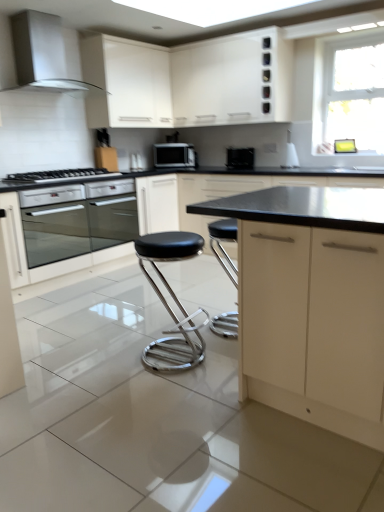
At what (x,y) coordinates should I click in order to perform the action: click on satin silver range hood at upper left. Please return your answer as a coordinate pair (x, y). Looking at the image, I should click on (42, 54).

Describe the element at coordinates (42, 54) in the screenshot. I see `satin silver range hood at upper left` at that location.

Where is `white matte cabinet at upper center, which appears as the 1th cabinetry when viewed from the top`? The height and width of the screenshot is (512, 384). white matte cabinet at upper center, which appears as the 1th cabinetry when viewed from the top is located at coordinates (188, 81).

The image size is (384, 512). What do you see at coordinates (227, 193) in the screenshot? I see `black matte cabinet at center, positioned as the 2th cabinetry in bottom-to-top order` at bounding box center [227, 193].

At what (x,y) coordinates should I click in order to perform the action: click on white matte cabinet at upper center, which ranks as the second cabinetry in top-to-bottom order. Please return your answer as a coordinate pair (x, y). Image resolution: width=384 pixels, height=512 pixels. Looking at the image, I should click on (126, 83).

The width and height of the screenshot is (384, 512). Describe the element at coordinates (312, 304) in the screenshot. I see `matte cream cabinet at center, the 1th cabinetry positioned from the bottom` at that location.

Locate an element on the screen. matte cream cabinet at center, acting as the fourth cabinetry starting from the top is located at coordinates (312, 304).

Where is `matte black microwave at center`? This screenshot has width=384, height=512. matte black microwave at center is located at coordinates (174, 155).

What do you see at coordinates (240, 158) in the screenshot?
I see `black glossy toaster at center` at bounding box center [240, 158].

Where is `satin silver range hood at upper left`? satin silver range hood at upper left is located at coordinates (42, 54).

From the image's perspective, which object appears higher, black leather stool at center or satin silver oven at lower left?

satin silver oven at lower left is shown above in the image.

Looking at this image, does black leather stool at center contain satin silver oven at lower left?

No, satin silver oven at lower left is not a part of black leather stool at center.

From the picture: Could you tell me if black leather stool at center is turned towards satin silver oven at lower left?

No, black leather stool at center is not facing towards satin silver oven at lower left.

Considering the sizes of satin silver oven at lower left and white matte cabinet at upper center, the 3th cabinetry positioned from the bottom, in the image, is satin silver oven at lower left wider or thinner than white matte cabinet at upper center, the 3th cabinetry positioned from the bottom,?

satin silver oven at lower left is wider than white matte cabinet at upper center, the 3th cabinetry positioned from the bottom.

Where is `cabinetry that is the 1st object above the satin silver oven at lower left (from a real-world perspective)`? This screenshot has width=384, height=512. cabinetry that is the 1st object above the satin silver oven at lower left (from a real-world perspective) is located at coordinates (126, 83).

Considering the sizes of objects satin silver oven at lower left and white matte cabinet at upper center, the 3th cabinetry positioned from the bottom, in the image provided, who is taller, satin silver oven at lower left or white matte cabinet at upper center, the 3th cabinetry positioned from the bottom,?

Standing taller between the two is white matte cabinet at upper center, the 3th cabinetry positioned from the bottom.

Considering the sizes of objects matte cream cabinet at center, acting as the fourth cabinetry starting from the top, and satin silver range hood at upper left in the image provided, who is taller, matte cream cabinet at center, acting as the fourth cabinetry starting from the top, or satin silver range hood at upper left?

matte cream cabinet at center, acting as the fourth cabinetry starting from the top.

Is matte cream cabinet at center, the 1th cabinetry positioned from the bottom, behind satin silver range hood at upper left?

No, matte cream cabinet at center, the 1th cabinetry positioned from the bottom, is in front of satin silver range hood at upper left.

What's the angular difference between matte cream cabinet at center, the 1th cabinetry positioned from the bottom, and satin silver range hood at upper left's facing directions?

There is a 179-degree angle between the facing directions of matte cream cabinet at center, the 1th cabinetry positioned from the bottom, and satin silver range hood at upper left.

Which is behind, matte cream cabinet at center, acting as the fourth cabinetry starting from the top, or satin silver oven at lower left?

satin silver oven at lower left is further away from the camera.

Based on the photo, which of these two, matte cream cabinet at center, acting as the fourth cabinetry starting from the top, or satin silver oven at lower left, is thinner?

satin silver oven at lower left.

Can you confirm if matte cream cabinet at center, acting as the fourth cabinetry starting from the top, is positioned to the right of satin silver oven at lower left?

Indeed, matte cream cabinet at center, acting as the fourth cabinetry starting from the top, is positioned on the right side of satin silver oven at lower left.

From the picture: Can you confirm if matte cream cabinet at center, the 1th cabinetry positioned from the bottom, is shorter than satin silver oven at lower left?

No, matte cream cabinet at center, the 1th cabinetry positioned from the bottom, is not shorter than satin silver oven at lower left.

From a real-world perspective, between black leather stool at center and white matte cabinet at upper center, the 3th cabinetry positioned from the bottom, who is vertically higher?

white matte cabinet at upper center, the 3th cabinetry positioned from the bottom.

Which object is further away from the camera taking this photo, black leather stool at center or white matte cabinet at upper center, the 3th cabinetry positioned from the bottom?

white matte cabinet at upper center, the 3th cabinetry positioned from the bottom, is further from the camera.

Is black leather stool at center oriented towards white matte cabinet at upper center, the 3th cabinetry positioned from the bottom?

No, black leather stool at center is not aimed at white matte cabinet at upper center, the 3th cabinetry positioned from the bottom.

Based on the photo, from a real-world perspective, is satin silver oven at lower left on black matte cabinet at center, marked as the 3th cabinetry in a top-to-bottom arrangement?

Yes, from a real-world perspective, satin silver oven at lower left is over black matte cabinet at center, marked as the 3th cabinetry in a top-to-bottom arrangement

Between satin silver oven at lower left and black matte cabinet at center, positioned as the 2th cabinetry in bottom-to-top order, which one has smaller size?

satin silver oven at lower left.

Based on the photo, which is in front, satin silver oven at lower left or black matte cabinet at center, marked as the 3th cabinetry in a top-to-bottom arrangement?

Positioned in front is black matte cabinet at center, marked as the 3th cabinetry in a top-to-bottom arrangement.

Can you tell me how much satin silver oven at lower left and black matte cabinet at center, marked as the 3th cabinetry in a top-to-bottom arrangement, differ in facing direction?

satin silver oven at lower left and black matte cabinet at center, marked as the 3th cabinetry in a top-to-bottom arrangement, are facing 90.3 degrees away from each other.

Considering the sizes of white matte cabinet at upper center, which ranks as the second cabinetry in top-to-bottom order, and matte black microwave at center in the image, is white matte cabinet at upper center, which ranks as the second cabinetry in top-to-bottom order, bigger or smaller than matte black microwave at center?

Considering their sizes, white matte cabinet at upper center, which ranks as the second cabinetry in top-to-bottom order, takes up more space than matte black microwave at center.

Which of these two, white matte cabinet at upper center, the 3th cabinetry positioned from the bottom, or matte black microwave at center, stands shorter?

Standing shorter between the two is matte black microwave at center.

From the image's perspective, is white matte cabinet at upper center, which ranks as the second cabinetry in top-to-bottom order, over matte black microwave at center?

Correct, white matte cabinet at upper center, which ranks as the second cabinetry in top-to-bottom order, appears higher than matte black microwave at center in the image.

This screenshot has height=512, width=384. I want to click on the 1st cabinetry above the matte black microwave at center (from the image's perspective), so click(x=126, y=83).

At what (x,y) coordinates should I click in order to perform the action: click on stool on the right of satin silver oven at lower left. Please return your answer as a coordinate pair (x, y). Looking at the image, I should click on (173, 298).

I want to click on oven lying on the left of white matte cabinet at upper center, the 3th cabinetry positioned from the bottom, so click(77, 219).

Based on their spatial positions, is black matte cabinet at center, positioned as the 2th cabinetry in bottom-to-top order, or satin silver range hood at upper left closer to black leather stool at center?

black matte cabinet at center, positioned as the 2th cabinetry in bottom-to-top order.

Based on their spatial positions, is white matte cabinet at upper center, the 3th cabinetry positioned from the bottom, or black matte cabinet at center, marked as the 3th cabinetry in a top-to-bottom arrangement, closer to satin silver oven at lower left?

The object closer to satin silver oven at lower left is black matte cabinet at center, marked as the 3th cabinetry in a top-to-bottom arrangement.

Considering their positions, is black stainless steel gas stove at left positioned closer to matte cream cabinet at center, acting as the fourth cabinetry starting from the top, than black leather stool at center?

The object closer to matte cream cabinet at center, acting as the fourth cabinetry starting from the top, is black leather stool at center.

Which object lies further to the anchor point black glossy toaster at center, matte black microwave at center or matte cream cabinet at center, the 1th cabinetry positioned from the bottom?

Among the two, matte cream cabinet at center, the 1th cabinetry positioned from the bottom, is located further to black glossy toaster at center.

Estimate the real-world distances between objects in this image. Which object is closer to matte black microwave at center, satin silver range hood at upper left or white matte cabinet at upper center, the 3th cabinetry positioned from the bottom?

white matte cabinet at upper center, the 3th cabinetry positioned from the bottom.

Estimate the real-world distances between objects in this image. Which object is further from black stainless steel gas stove at left, matte cream cabinet at center, the 1th cabinetry positioned from the bottom, or black leather stool at center?

matte cream cabinet at center, the 1th cabinetry positioned from the bottom, is positioned further to the anchor black stainless steel gas stove at left.

Estimate the real-world distances between objects in this image. Which object is closer to white matte cabinet at upper center, arranged as the fourth cabinetry when ordered from the bottom, white matte cabinet at upper center, which ranks as the second cabinetry in top-to-bottom order, or black matte cabinet at center, positioned as the 2th cabinetry in bottom-to-top order?

white matte cabinet at upper center, which ranks as the second cabinetry in top-to-bottom order, lies closer to white matte cabinet at upper center, arranged as the fourth cabinetry when ordered from the bottom, than the other object.

Which object lies further to the anchor point black leather stool at center, black matte cabinet at center, positioned as the 2th cabinetry in bottom-to-top order, or satin silver oven at lower left?

black matte cabinet at center, positioned as the 2th cabinetry in bottom-to-top order, is further to black leather stool at center.

This screenshot has width=384, height=512. I want to click on home appliance between white matte cabinet at upper center, the 3th cabinetry positioned from the bottom, and black leather stool at center in the up-down direction, so click(x=42, y=54).

At what (x,y) coordinates should I click in order to perform the action: click on oven between matte cream cabinet at center, the 1th cabinetry positioned from the bottom, and matte black microwave at center from front to back. Please return your answer as a coordinate pair (x, y). The height and width of the screenshot is (512, 384). Looking at the image, I should click on (77, 219).

Find the location of a particular element. appliance between black leather stool at center and matte black microwave at center in the front-back direction is located at coordinates (240, 158).

Where is `gas stove between satin silver range hood at upper left and black leather stool at center from top to bottom`? Image resolution: width=384 pixels, height=512 pixels. gas stove between satin silver range hood at upper left and black leather stool at center from top to bottom is located at coordinates (58, 176).